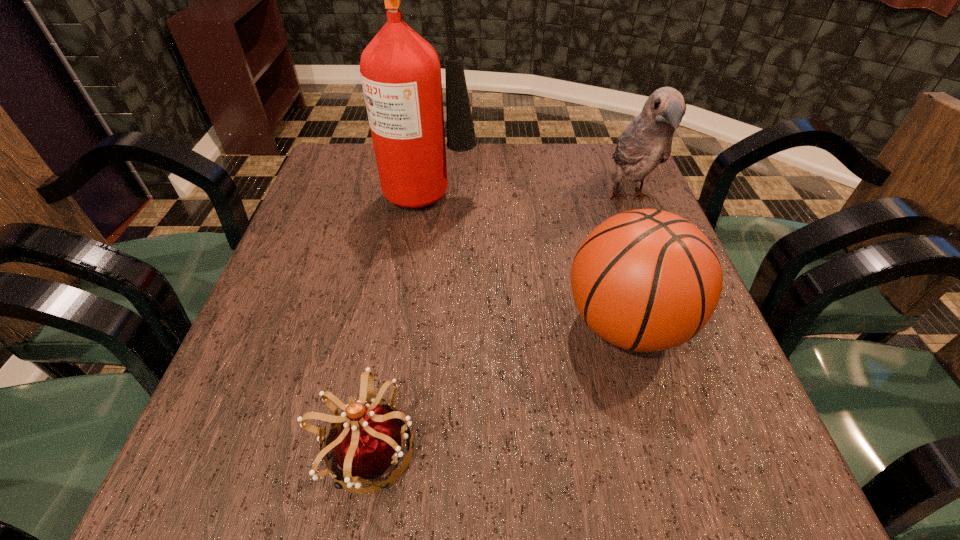
Image resolution: width=960 pixels, height=540 pixels. In order to click on object that is the second closest to the second tallest object in this screenshot , I will do `click(400, 71)`.

At what (x,y) coordinates should I click in order to perform the action: click on object identified as the third closest to the second nearest object. Please return your answer as a coordinate pair (x, y). This screenshot has height=540, width=960. Looking at the image, I should click on (400, 71).

Where is `free space that satisfies the following two spatial constraints: 1. at the nozzle of the fire extinguisher; 2. on the left side of the second nearest object`? Image resolution: width=960 pixels, height=540 pixels. free space that satisfies the following two spatial constraints: 1. at the nozzle of the fire extinguisher; 2. on the left side of the second nearest object is located at coordinates (414, 325).

Image resolution: width=960 pixels, height=540 pixels. I want to click on vacant position in the image that satisfies the following two spatial constraints: 1. on the front-facing side of the parrot; 2. on the front-facing side of the shortest object, so click(x=728, y=451).

Locate an element on the screen. This screenshot has width=960, height=540. blank space that satisfies the following two spatial constraints: 1. on the front-facing side of the parrot; 2. on the front-facing side of the shortest object is located at coordinates (728, 451).

Find the location of a particular element. This screenshot has height=540, width=960. vacant space that satisfies the following two spatial constraints: 1. on the front side of the third farthest object; 2. on the front-facing side of the shortest object is located at coordinates (662, 451).

Locate an element on the screen. This screenshot has width=960, height=540. vacant point that satisfies the following two spatial constraints: 1. on the front-facing side of the parrot; 2. on the front-facing side of the shortest object is located at coordinates (728, 451).

The height and width of the screenshot is (540, 960). Find the location of `free spot that satisfies the following two spatial constraints: 1. on the front-facing side of the second tallest object; 2. on the front-facing side of the tiara`. free spot that satisfies the following two spatial constraints: 1. on the front-facing side of the second tallest object; 2. on the front-facing side of the tiara is located at coordinates (728, 451).